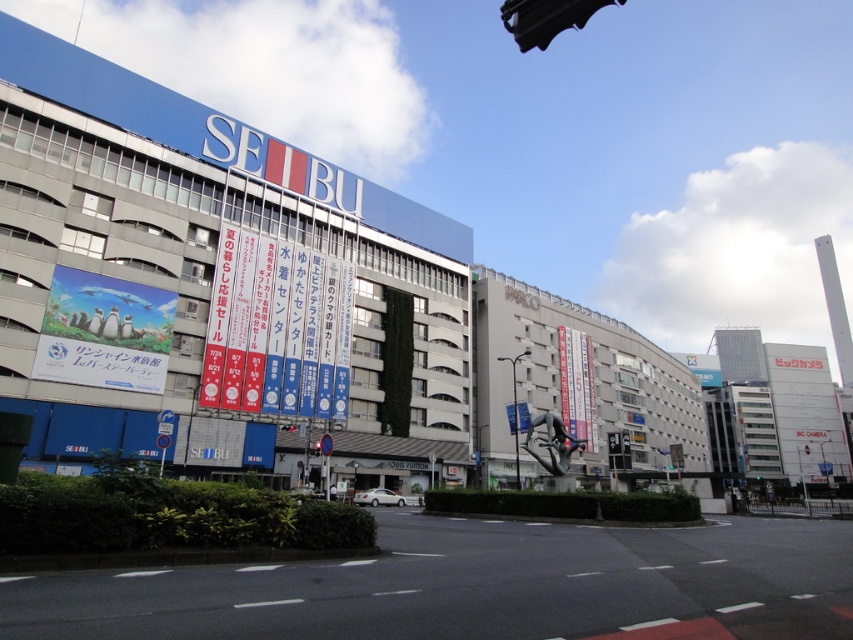
Question: Which object is farther from the camera taking this photo?

Choices:
 (A) white paper banners at center
 (B) red glass traffic light at center
 (C) black plastic traffic light at upper center

Answer: (C)

Question: Among these objects, which one is nearest to the camera?

Choices:
 (A) black plastic traffic light at upper center
 (B) white paper banners at center

Answer: (B)

Question: Is white paper banners at center positioned at the back of black plastic traffic light at upper center?

Choices:
 (A) no
 (B) yes

Answer: (A)

Question: Can you confirm if black plastic traffic light at upper center is thinner than red glass traffic light at center?

Choices:
 (A) yes
 (B) no

Answer: (B)

Question: Which object appears farthest from the camera in this image?

Choices:
 (A) red glass traffic light at center
 (B) white paper banners at center

Answer: (A)

Question: Is white paper banners at center wider than red glass traffic light at center?

Choices:
 (A) no
 (B) yes

Answer: (B)